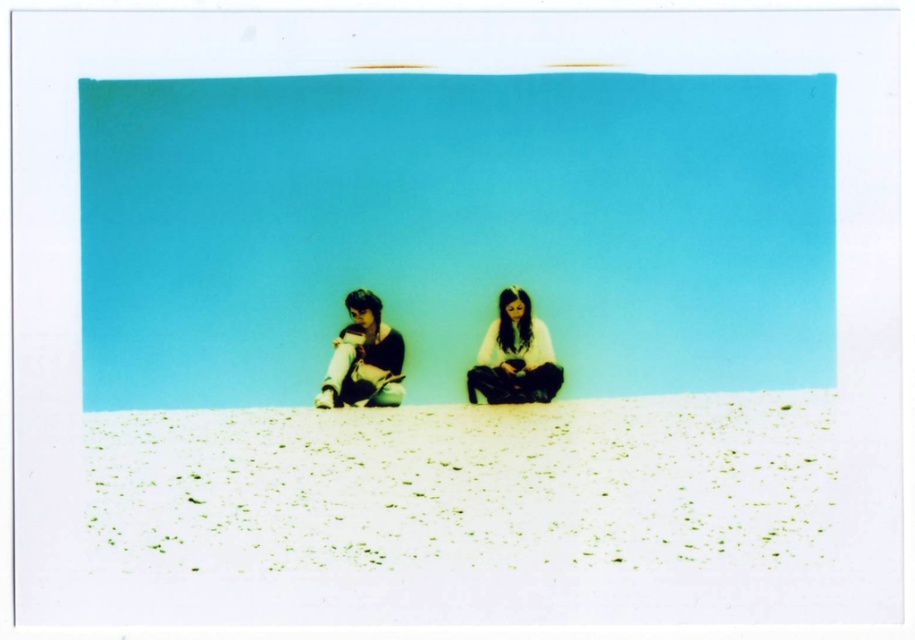
Who is positioned more to the left, white matte shirt at center or matte white pants at center left?

matte white pants at center left is more to the left.

Does white matte shirt at center appear on the right side of matte white pants at center left?

Correct, you'll find white matte shirt at center to the right of matte white pants at center left.

Which is in front, point (522, 380) or point (382, 323)?

Point (522, 380) is in front.

Locate an element on the screen. Image resolution: width=915 pixels, height=640 pixels. white matte shirt at center is located at coordinates (514, 355).

Between white sandy ground at lower center and white matte shirt at center, which one has less height?

With less height is white matte shirt at center.

Is point (156, 532) positioned in front of point (545, 374)?

Yes, it is.

Where is `white sandy ground at lower center`? white sandy ground at lower center is located at coordinates (x=467, y=483).

How far apart are white sandy ground at lower center and matte white pants at center left?

A distance of 1.74 meters exists between white sandy ground at lower center and matte white pants at center left.

Can you confirm if white sandy ground at lower center is positioned above matte white pants at center left?

No.

Who is more distant from viewer, (351, 538) or (368, 300)?

The point (368, 300) is behind.

Identify the location of white sandy ground at lower center. (467, 483).